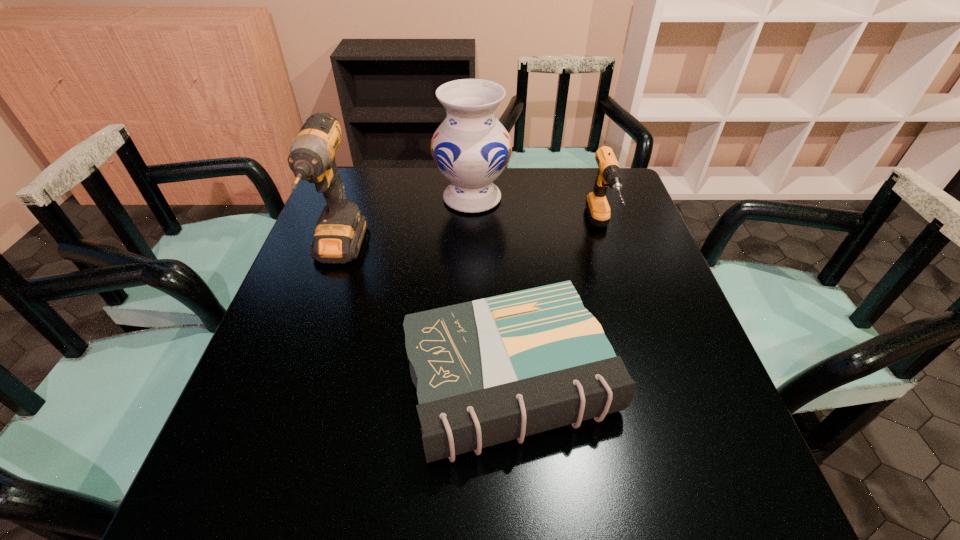
Where is `the left drill`? the left drill is located at coordinates (340, 230).

At what (x,y) coordinates should I click in order to perform the action: click on the taller drill. Please return your answer as a coordinate pair (x, y). The image size is (960, 540). Looking at the image, I should click on (340, 230).

The height and width of the screenshot is (540, 960). In order to click on vase in this screenshot , I will do `click(471, 148)`.

The width and height of the screenshot is (960, 540). I want to click on the second shortest object, so (609, 174).

What are the coordinates of `the right drill` in the screenshot? It's located at (609, 174).

This screenshot has height=540, width=960. Find the location of `paperback book`. paperback book is located at coordinates (488, 371).

At what (x,y) coordinates should I click in order to perform the action: click on the shortest object. Please return your answer as a coordinate pair (x, y). This screenshot has width=960, height=540. Looking at the image, I should click on (488, 371).

Identify the location of free space located 0.140m with the drill bit of the leftmost object facing forward. Image resolution: width=960 pixels, height=540 pixels. (309, 334).

At what (x,y) coordinates should I click in order to perform the action: click on vacant space located on the back of the vase. Please return your answer as a coordinate pair (x, y). Image resolution: width=960 pixels, height=540 pixels. Looking at the image, I should click on (472, 170).

What are the coordinates of `vacant area situated 0.120m at the tip of the rightmost object` in the screenshot? It's located at (621, 294).